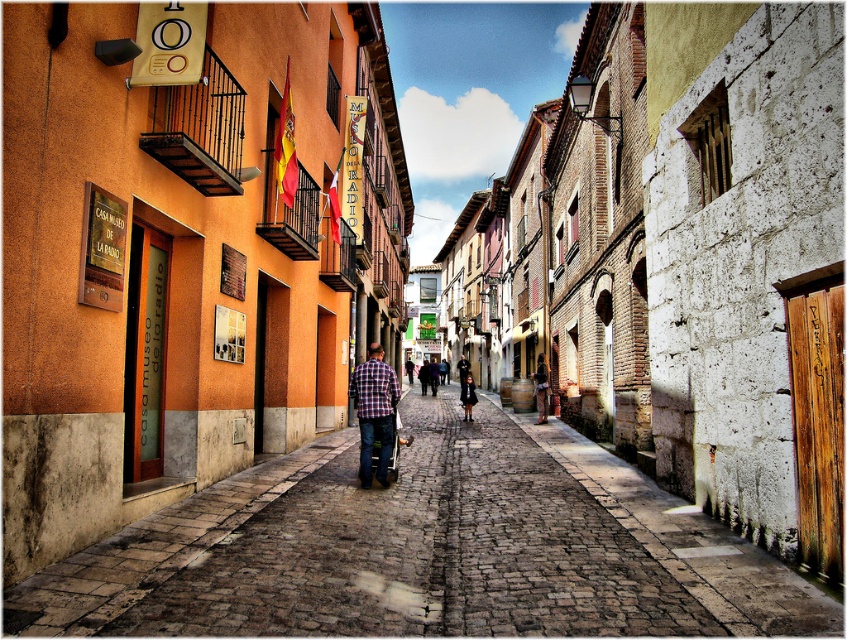
Who is more forward, (327, 538) or (397, 435)?

Point (327, 538)

Is cobblestone pavement at center shorter than blue fabric cart at center?

Yes, cobblestone pavement at center is shorter than blue fabric cart at center.

Does point (133, 618) lie behind point (397, 451)?

No, it is in front of (397, 451).

The width and height of the screenshot is (847, 640). In order to click on cobblestone pavement at center in this screenshot , I will do `click(427, 548)`.

Which is more to the right, cobblestone pavement at center or matte brown leather bag at center?

Positioned to the right is matte brown leather bag at center.

Is point (79, 561) more distant than point (540, 420)?

No, it is not.

Describe the element at coordinates (427, 548) in the screenshot. I see `cobblestone pavement at center` at that location.

Image resolution: width=847 pixels, height=640 pixels. In order to click on cobblestone pavement at center in this screenshot , I will do `click(427, 548)`.

Can you confirm if cobblestone pavement at center is thinner than dark brown leather coat at center?

No.

Between point (523, 481) and point (463, 400), which one is positioned in front?

Point (523, 481)

This screenshot has width=847, height=640. Identify the location of cobblestone pavement at center. (427, 548).